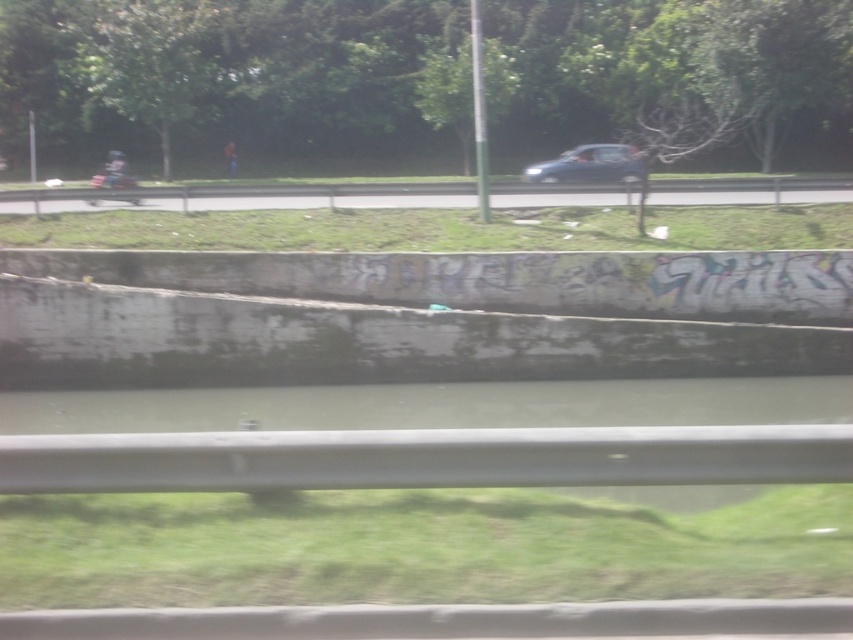
You are driving a car and see the gray metallic river at center and the satin blue sedan at center ahead on the road. How far apart are the two vehicles?

The gray metallic river at center is 17.59 meters away from the satin blue sedan at center.

You are a passenger in a car and looking out the window. You see a gray metallic river at center and a satin blue sedan at center. Which object is closer to you?

The gray metallic river at center is closer to the viewer than the satin blue sedan at center.